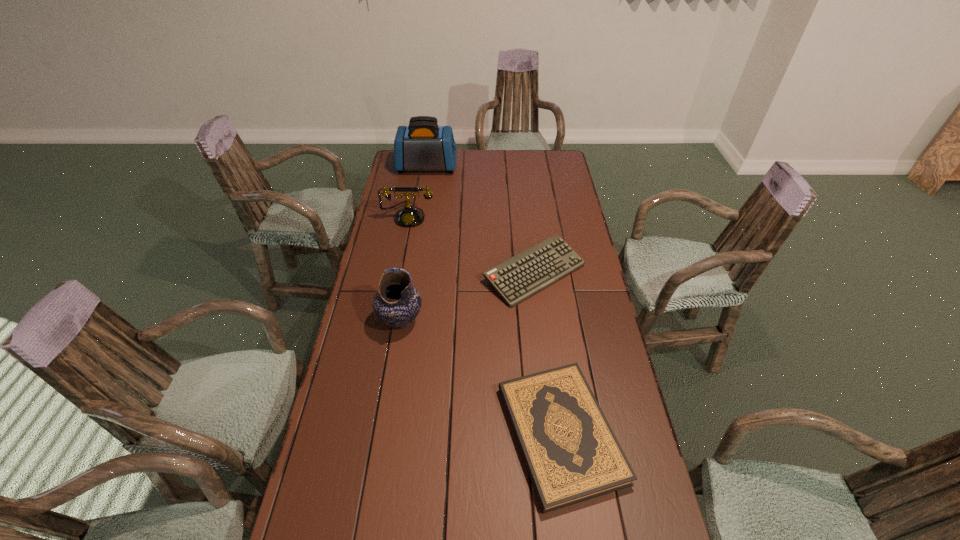
The width and height of the screenshot is (960, 540). Find the location of `vacant point located 0.090m on the dial of the telephone`. vacant point located 0.090m on the dial of the telephone is located at coordinates pos(404,242).

This screenshot has height=540, width=960. I want to click on blank space located 0.360m on the left of the fourth tallest object, so point(387,273).

Locate an element on the screen. This screenshot has width=960, height=540. blank space located on the back of the shortest object is located at coordinates (549, 347).

In order to click on object at the far edge in this screenshot , I will do `click(423, 145)`.

Locate an element on the screen. The height and width of the screenshot is (540, 960). toaster at the left edge is located at coordinates (423, 145).

Find the location of a particular element. Image resolution: width=960 pixels, height=540 pixels. pottery that is positioned at the left edge is located at coordinates (397, 303).

You are a GUI agent. You are given a task and a screenshot of the screen. Output one action in this format:
    pyautogui.click(x=<x>, y=<y>)
    Task: Click on the telephone located at the left edge
    This screenshot has height=540, width=960.
    Given the screenshot: What is the action you would take?
    point(409,216)

Where is `computer keyboard at the right edge`? This screenshot has height=540, width=960. computer keyboard at the right edge is located at coordinates (521, 276).

Find the location of a particular element. hardback book located in the right edge section of the desktop is located at coordinates (572, 455).

Image resolution: width=960 pixels, height=540 pixels. Find the location of `object located at the far left corner`. object located at the far left corner is located at coordinates (423, 145).